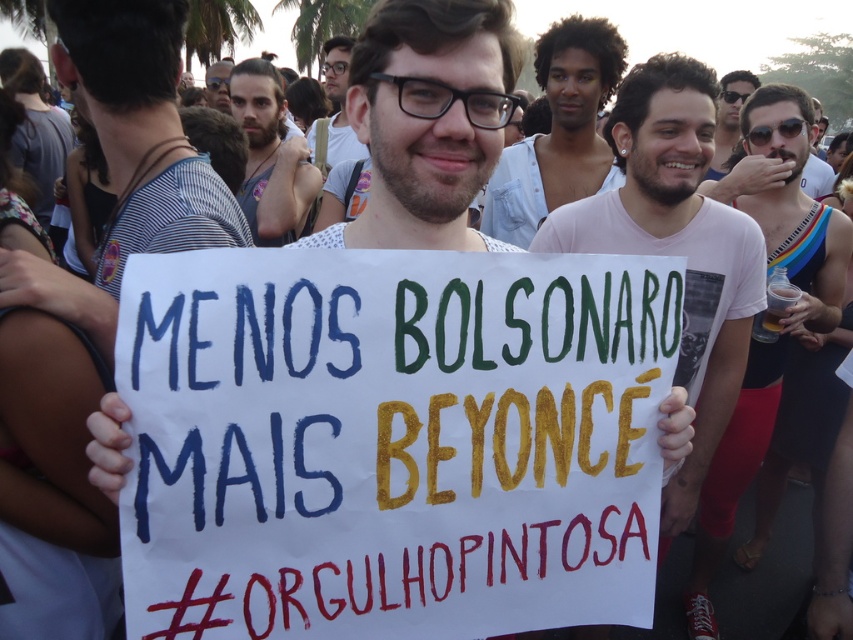
You are a photographer standing at the camera position. You want to take a closeup photo of the white tank top at center. Can you estimate if you need to move closer or farther away from the current position to achieve a closer focus?

The white tank top at center is currently 7.79 feet away from the camera. To get a closer focus for a closeup, you would need to move closer to reduce the distance between the camera and the white tank top at center.